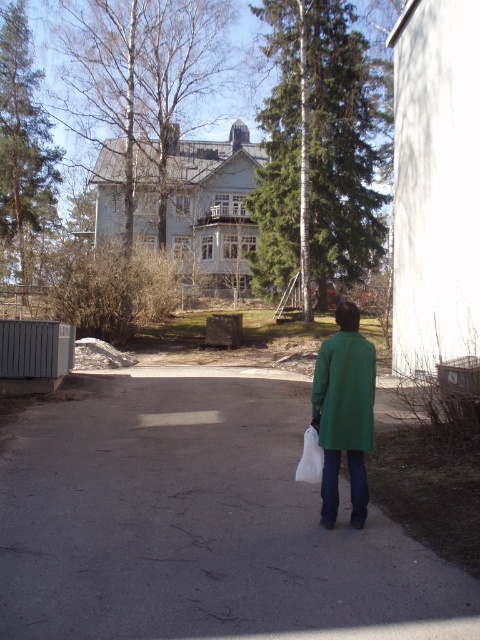
Which is more to the right, gray asphalt pavement at center or green matte jacket at lower center?

green matte jacket at lower center

Is gray asphalt pavement at center taller than green matte jacket at lower center?

Incorrect, gray asphalt pavement at center's height is not larger of green matte jacket at lower center's.

Identify the location of gray asphalt pavement at center. (199, 522).

I want to click on gray asphalt pavement at center, so click(199, 522).